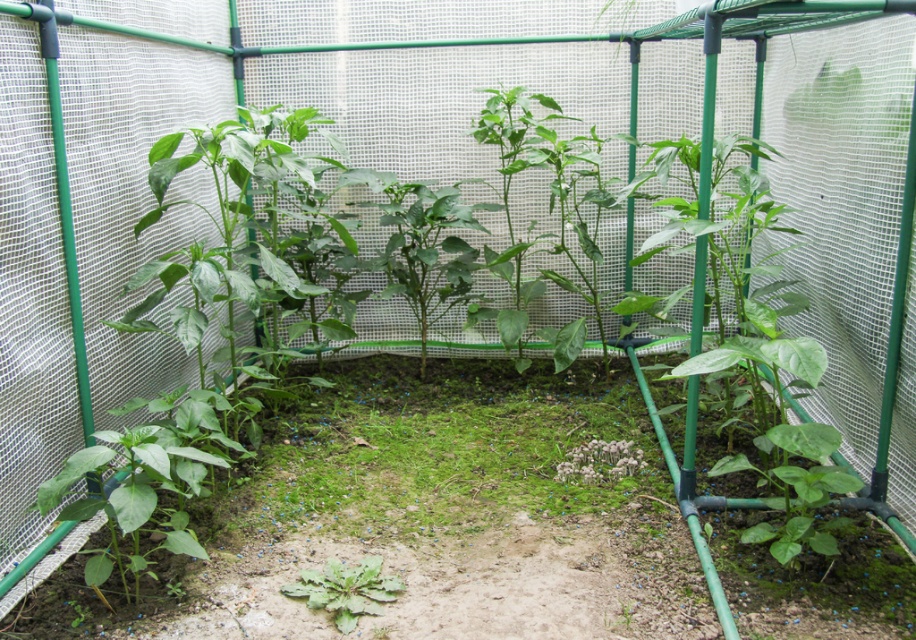
Does green mossy grass at center appear under green matte plant at center?

Actually, green mossy grass at center is above green matte plant at center.

Does point (391, 520) come farther from viewer compared to point (341, 570)?

Yes, point (391, 520) is behind point (341, 570).

Locate an element on the screen. The image size is (916, 640). green mossy grass at center is located at coordinates [x=449, y=449].